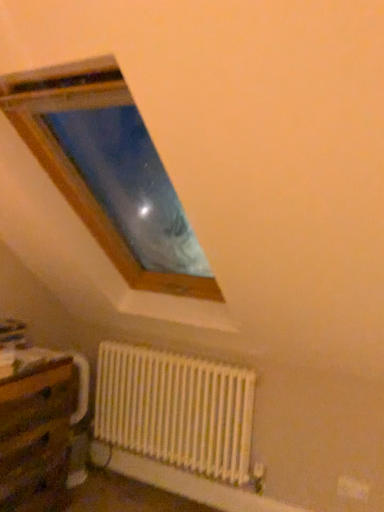
The image size is (384, 512). Describe the element at coordinates (36, 436) in the screenshot. I see `wooden table at lower left` at that location.

Where is `wooden table at lower left`? The image size is (384, 512). wooden table at lower left is located at coordinates (36, 436).

Measure the distance between white matte radiator at lower center and camera.

The depth of white matte radiator at lower center is 2.22 meters.

This screenshot has width=384, height=512. Find the location of `white matte radiator at lower center`. white matte radiator at lower center is located at coordinates (176, 410).

The height and width of the screenshot is (512, 384). What do you see at coordinates (176, 410) in the screenshot? I see `white matte radiator at lower center` at bounding box center [176, 410].

This screenshot has height=512, width=384. Identify the location of wooden table at lower left. point(36,436).

Based on their positions, is wooden table at lower left located to the left or right of white matte radiator at lower center?

Clearly, wooden table at lower left is on the left of white matte radiator at lower center in the image.

Considering the positions of objects wooden table at lower left and white matte radiator at lower center in the image provided, who is in front, wooden table at lower left or white matte radiator at lower center?

wooden table at lower left is more forward.

Is point (33, 508) farther from camera compared to point (169, 406)?

No.

From the image's perspective, does wooden table at lower left appear lower than white matte radiator at lower center?

Yes, from the image's perspective, wooden table at lower left is below white matte radiator at lower center.

From a real-world perspective, which is physically below, wooden table at lower left or white matte radiator at lower center?

In real-world perspective, wooden table at lower left is lower.

Can you confirm if wooden table at lower left is wider than white matte radiator at lower center?

Yes.

Is wooden table at lower left taller than white matte radiator at lower center?

Yes.

Is wooden table at lower left bigger or smaller than white matte radiator at lower center?

Considering their sizes, wooden table at lower left takes up more space than white matte radiator at lower center.

Based on the photo, is wooden table at lower left spatially inside white matte radiator at lower center, or outside of it?

wooden table at lower left exists outside the volume of white matte radiator at lower center.

Is wooden table at lower left touching white matte radiator at lower center?

wooden table at lower left and white matte radiator at lower center are not in contact.

From the picture: Is wooden table at lower left looking in the opposite direction of white matte radiator at lower center?

No.

Where is `radiator on the right of wooden table at lower left`? The height and width of the screenshot is (512, 384). radiator on the right of wooden table at lower left is located at coordinates (176, 410).

Is white matte radiator at lower center at the left side of wooden table at lower left?

Incorrect, white matte radiator at lower center is not on the left side of wooden table at lower left.

Is white matte radiator at lower center in front of or behind wooden table at lower left in the image?

white matte radiator at lower center is positioned farther from the viewer than wooden table at lower left.

Is point (196, 361) farther from camera compared to point (63, 451)?

Yes, point (196, 361) is behind point (63, 451).

From the image's perspective, would you say white matte radiator at lower center is positioned over wooden table at lower left?

Yes.

From a real-world perspective, who is located higher, white matte radiator at lower center or wooden table at lower left?

white matte radiator at lower center, from a real-world perspective.

Which of these two, white matte radiator at lower center or wooden table at lower left, is thinner?

white matte radiator at lower center.

Can you confirm if white matte radiator at lower center is shorter than wooden table at lower left?

Yes, white matte radiator at lower center is shorter than wooden table at lower left.

Considering the sizes of objects white matte radiator at lower center and wooden table at lower left in the image provided, who is bigger, white matte radiator at lower center or wooden table at lower left?

wooden table at lower left is bigger.

Is white matte radiator at lower center situated inside wooden table at lower left or outside?

white matte radiator at lower center is located beyond the bounds of wooden table at lower left.

Is white matte radiator at lower center beside wooden table at lower left?

No.

Looking at this image, is wooden table at lower left at the back of white matte radiator at lower center?

No, white matte radiator at lower center is not facing away from wooden table at lower left.

What's the angular difference between white matte radiator at lower center and wooden table at lower left's facing directions?

The facing directions of white matte radiator at lower center and wooden table at lower left are 89.2 degrees apart.

The height and width of the screenshot is (512, 384). In order to click on radiator above the wooden table at lower left (from a real-world perspective) in this screenshot , I will do 176,410.

The image size is (384, 512). I want to click on radiator on the right of wooden table at lower left, so click(x=176, y=410).

Where is `table below the white matte radiator at lower center (from the image's perspective)`? This screenshot has width=384, height=512. table below the white matte radiator at lower center (from the image's perspective) is located at coordinates (36, 436).